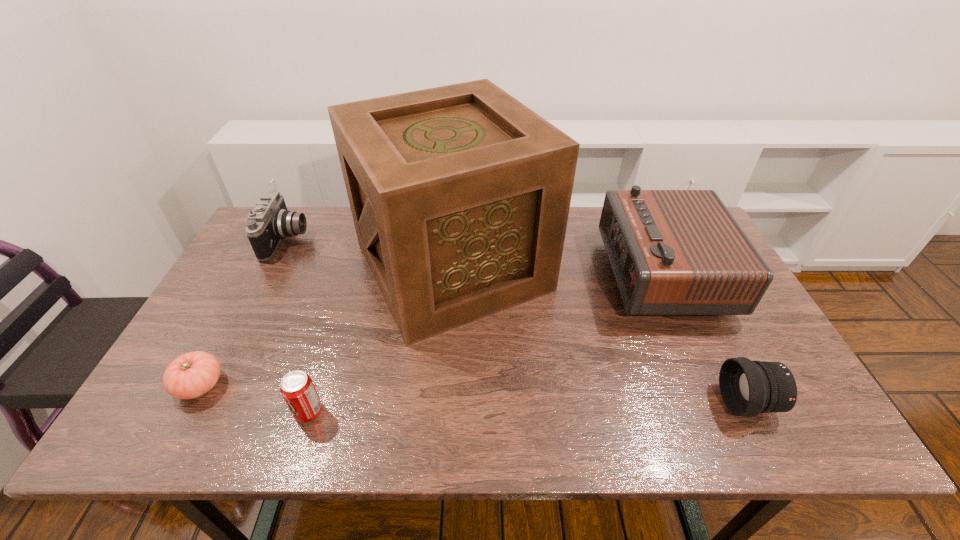
In the image, there is a desktop. At what (x,y) coordinates should I click in order to perform the action: click on vacant region at the near edge. Please return your answer as a coordinate pair (x, y). Looking at the image, I should click on (552, 413).

In the image, there is a desktop. Where is `vacant area at the left edge`? This screenshot has width=960, height=540. vacant area at the left edge is located at coordinates (222, 320).

In the image, there is a desktop. Where is `vacant space at the right edge`? Image resolution: width=960 pixels, height=540 pixels. vacant space at the right edge is located at coordinates (748, 342).

The image size is (960, 540). I want to click on vacant space at the far left corner of the desktop, so click(298, 238).

Identify the location of vacant area at the near left corner. (180, 425).

At what (x,y) coordinates should I click in order to perform the action: click on vacant space that is in between the soda and the box. Please return your answer as a coordinate pair (x, y). Looking at the image, I should click on (380, 340).

Image resolution: width=960 pixels, height=540 pixels. Identify the location of vacant space that's between the fifth shortest object and the telephoto lens. (705, 338).

Where is `free space that is in between the camera and the telephoto lens`? The width and height of the screenshot is (960, 540). free space that is in between the camera and the telephoto lens is located at coordinates (517, 321).

Find the location of a particular element. The image size is (960, 540). vacant area that lies between the tomato and the camera is located at coordinates (244, 313).

You are a GUI agent. You are given a task and a screenshot of the screen. Output one action in this format:
    pyautogui.click(x=<x>, y=<y>)
    Task: Click on the free point between the soda and the box
    The height and width of the screenshot is (540, 960).
    Given the screenshot: What is the action you would take?
    pyautogui.click(x=380, y=340)